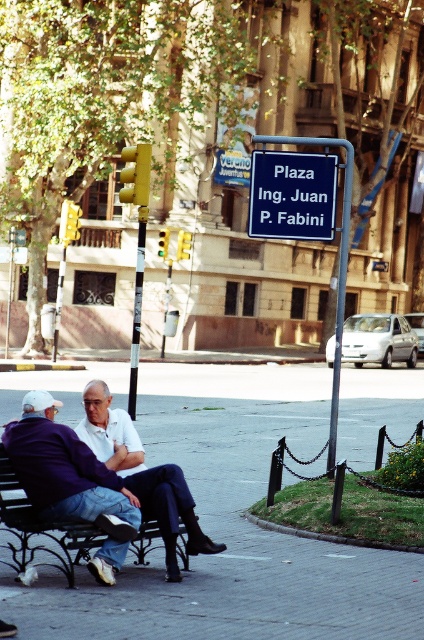
You are a city planner reviewing this plaza layout. You need to ensure that the blue plastic sign at center is visible from a distance without obstruction. Considering the black wrought iron bench at center, is the sign taller than the bench?

The blue plastic sign at center is taller than the black wrought iron bench at center, so it will remain visible over the bench from a distance.

You are standing at the point labeled with coordinates (231, 529). What type of surface are you standing on?

The point labeled with coordinates (231, 529) indicates gray concrete pavement at center, so you are standing on gray concrete pavement.

You are a delivery person trying to determine the best path to deliver a package to the signpost. You see the gray concrete pavement at center and the blue plastic sign at center. Which object is shorter in height?

The gray concrete pavement at center is not as tall as the blue plastic sign at center, so the gray concrete pavement at center is shorter in height.